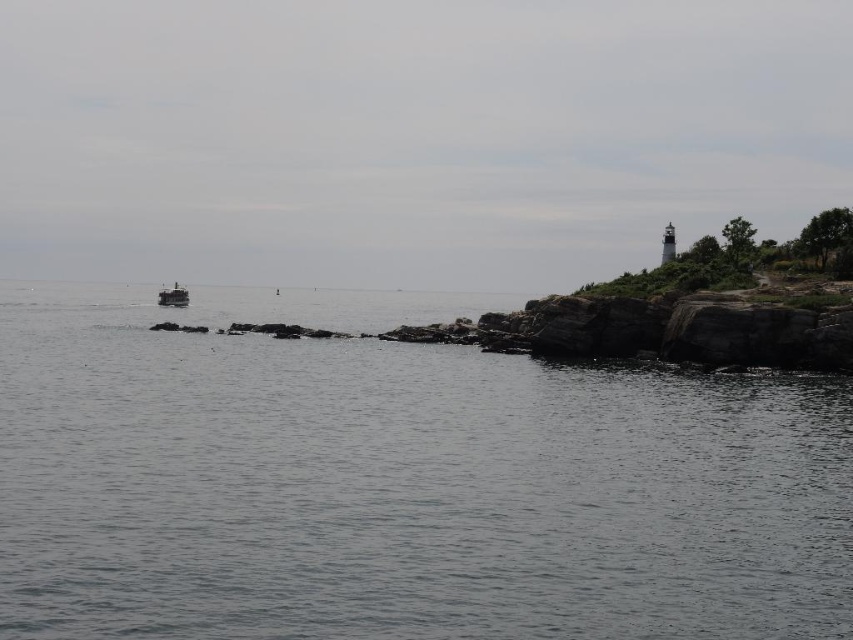
Can you confirm if gray water at center is positioned to the right of metallic gray boat at left?

Indeed, gray water at center is positioned on the right side of metallic gray boat at left.

Which is in front, point (688, 627) or point (166, 289)?

Positioned in front is point (688, 627).

Who is more distant from viewer, (721, 554) or (167, 288)?

Point (167, 288)

Find the location of a particular element. gray water at center is located at coordinates (398, 481).